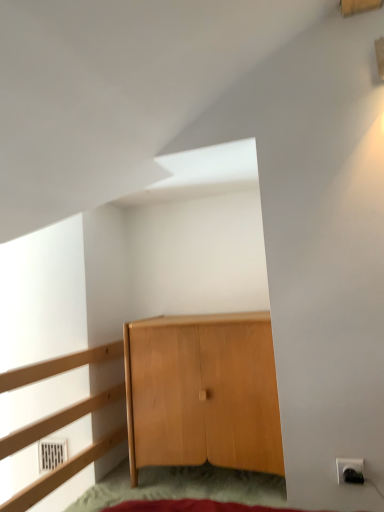
Question: From the image's perspective, is light wood dresser at left below light brown wood cabinet at center?

Choices:
 (A) yes
 (B) no

Answer: (B)

Question: Is light brown wood cabinet at center surrounded by light wood dresser at left?

Choices:
 (A) no
 (B) yes

Answer: (A)

Question: Does light wood dresser at left appear on the right side of light brown wood cabinet at center?

Choices:
 (A) yes
 (B) no

Answer: (B)

Question: Does light wood dresser at left turn towards light brown wood cabinet at center?

Choices:
 (A) yes
 (B) no

Answer: (B)

Question: Considering the relative positions of light wood dresser at left and light brown wood cabinet at center in the image provided, is light wood dresser at left in front of light brown wood cabinet at center?

Choices:
 (A) yes
 (B) no

Answer: (A)

Question: Is light wood dresser at left inside or outside of light brown wood cabinet at center?

Choices:
 (A) inside
 (B) outside

Answer: (B)

Question: Looking at their shapes, would you say light wood dresser at left is wider or thinner than light brown wood cabinet at center?

Choices:
 (A) thin
 (B) wide

Answer: (B)

Question: From the image's perspective, is light wood dresser at left positioned above or below light brown wood cabinet at center?

Choices:
 (A) above
 (B) below

Answer: (A)

Question: In the image, is light wood dresser at left positioned in front of or behind light brown wood cabinet at center?

Choices:
 (A) behind
 (B) front

Answer: (B)

Question: Considering the positions of point click(168, 418) and point click(339, 467), is point click(168, 418) closer or farther from the camera than point click(339, 467)?

Choices:
 (A) closer
 (B) farther

Answer: (B)

Question: Considering the relative positions of light brown wood cabinet at center and white plastic electric outlet at lower right in the image provided, is light brown wood cabinet at center to the left or to the right of white plastic electric outlet at lower right?

Choices:
 (A) left
 (B) right

Answer: (A)

Question: In the image, is light brown wood cabinet at center positioned in front of or behind white plastic electric outlet at lower right?

Choices:
 (A) behind
 (B) front

Answer: (A)

Question: Is light brown wood cabinet at center wider or thinner than white plastic electric outlet at lower right?

Choices:
 (A) wide
 (B) thin

Answer: (A)

Question: From a real-world perspective, is light brown wood cabinet at center physically located above or below light wood dresser at left?

Choices:
 (A) below
 (B) above

Answer: (A)

Question: Choose the correct answer: Is light brown wood cabinet at center inside light wood dresser at left or outside it?

Choices:
 (A) outside
 (B) inside

Answer: (A)